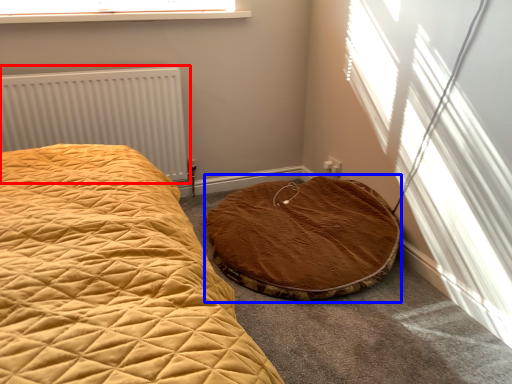
Question: Which point is closer to the camera, radiator (highlighted by a red box) or cat bed (highlighted by a blue box)?

Choices:
 (A) radiator
 (B) cat bed

Answer: (B)